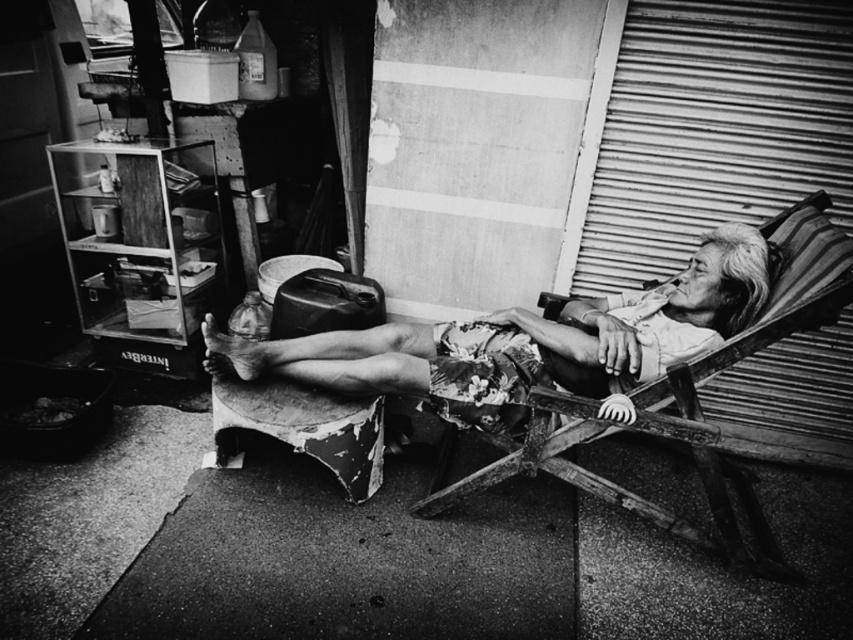
Question: Is floral fabric shorts at center thinner than wooden daybed at right?

Choices:
 (A) yes
 (B) no

Answer: (B)

Question: Is floral fabric shorts at center further to the viewer compared to wooden daybed at right?

Choices:
 (A) no
 (B) yes

Answer: (B)

Question: Which point appears closest to the camera in this image?

Choices:
 (A) (511, 324)
 (B) (614, 500)

Answer: (B)

Question: Which point is closer to the camera?

Choices:
 (A) (653, 342)
 (B) (735, 556)

Answer: (A)

Question: Observing the image, what is the correct spatial positioning of floral fabric shorts at center in reference to wooden daybed at right?

Choices:
 (A) below
 (B) above

Answer: (B)

Question: Among these objects, which one is nearest to the camera?

Choices:
 (A) wooden daybed at right
 (B) floral fabric shorts at center

Answer: (A)